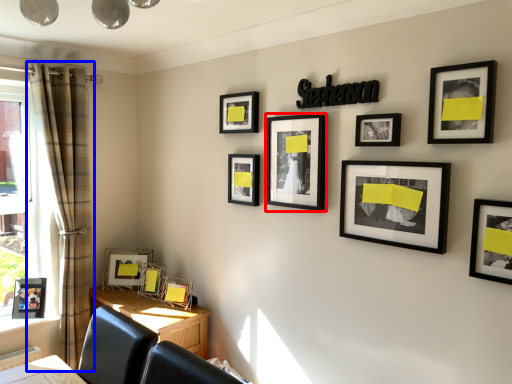
Question: Which of the following is the closest to the observer, picture frame (highlighted by a red box) or curtain (highlighted by a blue box)?

Choices:
 (A) picture frame
 (B) curtain

Answer: (A)